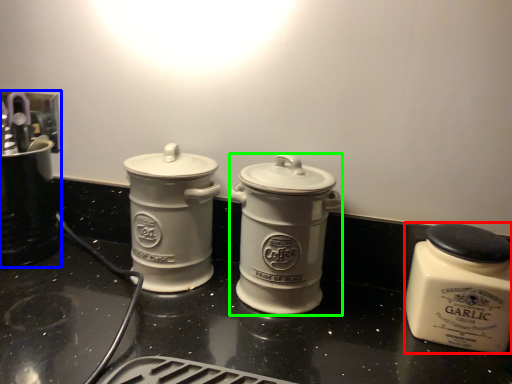
Question: Which object is the closest to the kitchen appliance (highlighted by a red box)? Choose among these: appliance (highlighted by a blue box) or kitchen appliance (highlighted by a green box).

Choices:
 (A) appliance
 (B) kitchen appliance

Answer: (B)